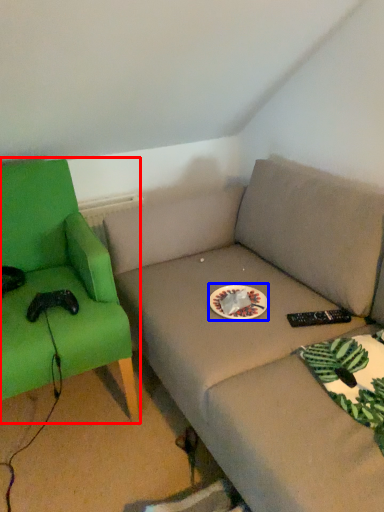
Question: Which of the following is the closest to the observer, chair (highlighted by a red box) or paper plate (highlighted by a blue box)?

Choices:
 (A) chair
 (B) paper plate

Answer: (A)